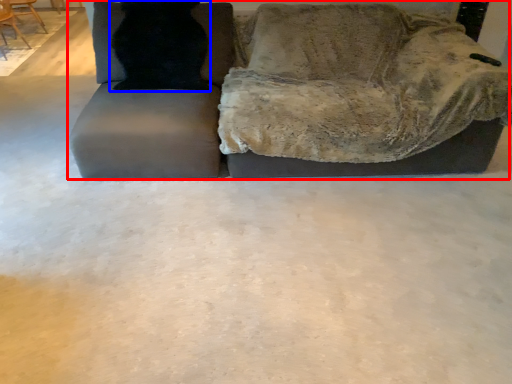
Question: Which object appears farthest to the camera in this image, studio couch (highlighted by a red box) or cat (highlighted by a blue box)?

Choices:
 (A) studio couch
 (B) cat

Answer: (B)